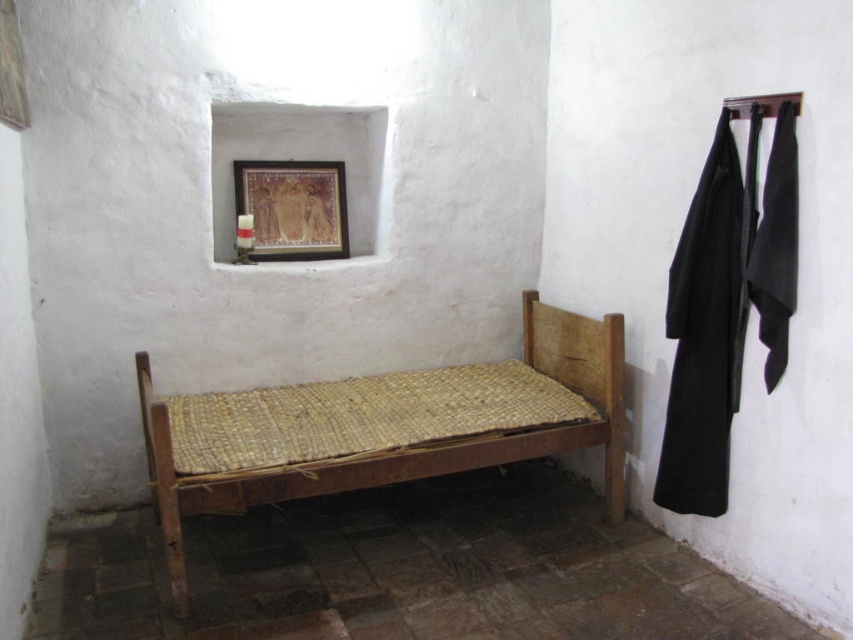
Does wooden woven matress at center have a greater width compared to wooden picture frame at upper center?

Indeed, wooden woven matress at center has a greater width compared to wooden picture frame at upper center.

Which is more to the right, wooden woven matress at center or wooden picture frame at upper center?

Positioned to the right is wooden woven matress at center.

What do you see at coordinates (386, 426) in the screenshot? This screenshot has height=640, width=853. I see `wooden woven matress at center` at bounding box center [386, 426].

You are a GUI agent. You are given a task and a screenshot of the screen. Output one action in this format:
    pyautogui.click(x=<x>, y=<y>)
    Task: Click on the wooden woven matress at center
    Image resolution: width=853 pixels, height=640 pixels.
    Given the screenshot: What is the action you would take?
    pyautogui.click(x=386, y=426)